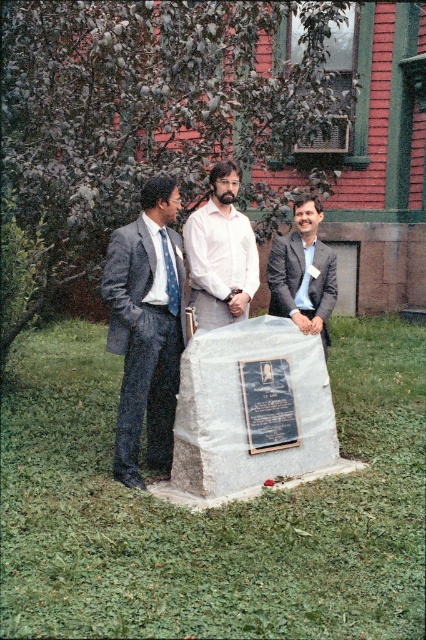
Question: Which object is farther from the camera taking this photo?

Choices:
 (A) gray stone monument at center
 (B) white cotton shirt at center
 (C) matte gray suit at center

Answer: (B)

Question: Estimate the real-world distances between objects in this image. Which object is farther from the black polished stone plaque at center?

Choices:
 (A) blue dotted tie at center
 (B) gray stone monument at center

Answer: (A)

Question: Can you confirm if white cotton shirt at center is wider than black polished stone plaque at center?

Choices:
 (A) no
 (B) yes

Answer: (B)

Question: Does gray textured suit at left have a greater width compared to black polished stone plaque at center?

Choices:
 (A) no
 (B) yes

Answer: (B)

Question: Among these objects, which one is farthest from the camera?

Choices:
 (A) blue dotted tie at center
 (B) gray stone monument at center
 (C) matte gray suit at center
 (D) gray textured suit at left

Answer: (C)

Question: Can you confirm if black polished stone plaque at center is thinner than blue dotted tie at center?

Choices:
 (A) yes
 (B) no

Answer: (B)